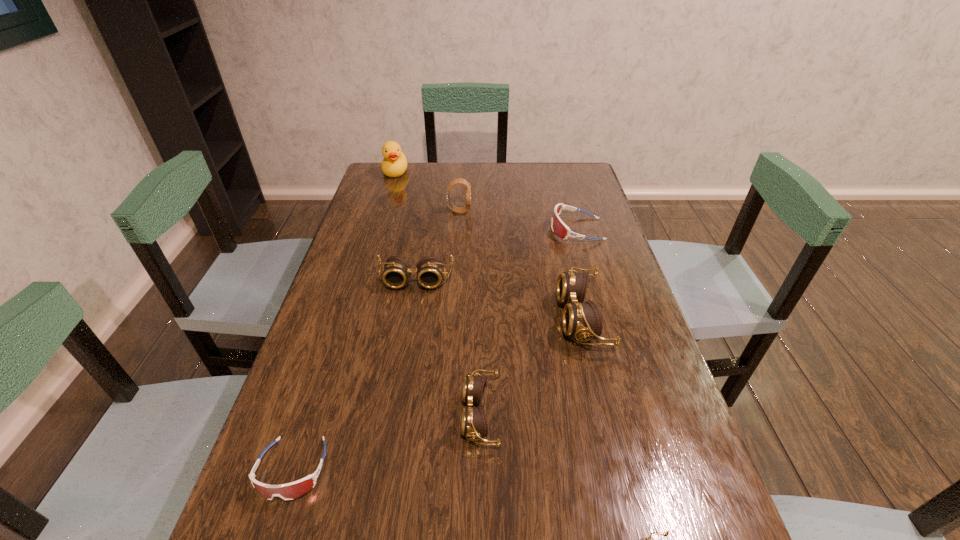
This screenshot has width=960, height=540. I want to click on the third biggest brown goggles, so click(x=474, y=424).

Locate an element on the screen. This screenshot has width=960, height=540. the left red goggles is located at coordinates click(293, 490).

Locate an element on the screen. The image size is (960, 540). the nearer red goggles is located at coordinates (293, 490).

Locate an element on the screen. The height and width of the screenshot is (540, 960). free region located 0.380m at the beak of the duck is located at coordinates (374, 242).

The height and width of the screenshot is (540, 960). I want to click on free space located on the face of the watch, so click(x=516, y=211).

This screenshot has width=960, height=540. I want to click on vacant space located through the lenses of the biggest brown goggles, so pyautogui.click(x=523, y=318).

Identify the location of free space located 0.320m through the lenses of the biggest brown goggles. (431, 318).

Where is `blank space located through the lenses of the biggest brown goggles`? The image size is (960, 540). blank space located through the lenses of the biggest brown goggles is located at coordinates (519, 318).

Where is `blank area located through the lenses of the fourth tallest object`? blank area located through the lenses of the fourth tallest object is located at coordinates (408, 326).

The height and width of the screenshot is (540, 960). I want to click on free space located on the front-facing side of the bigger red goggles, so click(x=531, y=230).